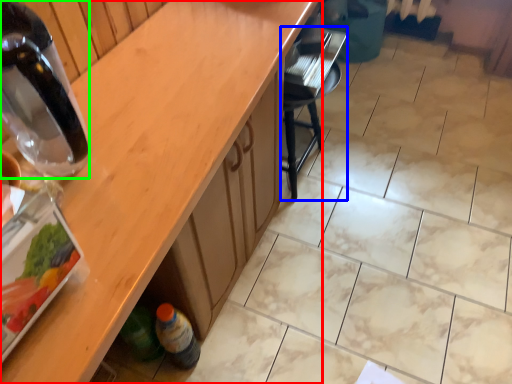
Question: Based on their relative distances, which object is nearer to countertop (highlighted by a red box)? Choose from chair (highlighted by a blue box) and bottle (highlighted by a green box).

Choices:
 (A) chair
 (B) bottle

Answer: (B)